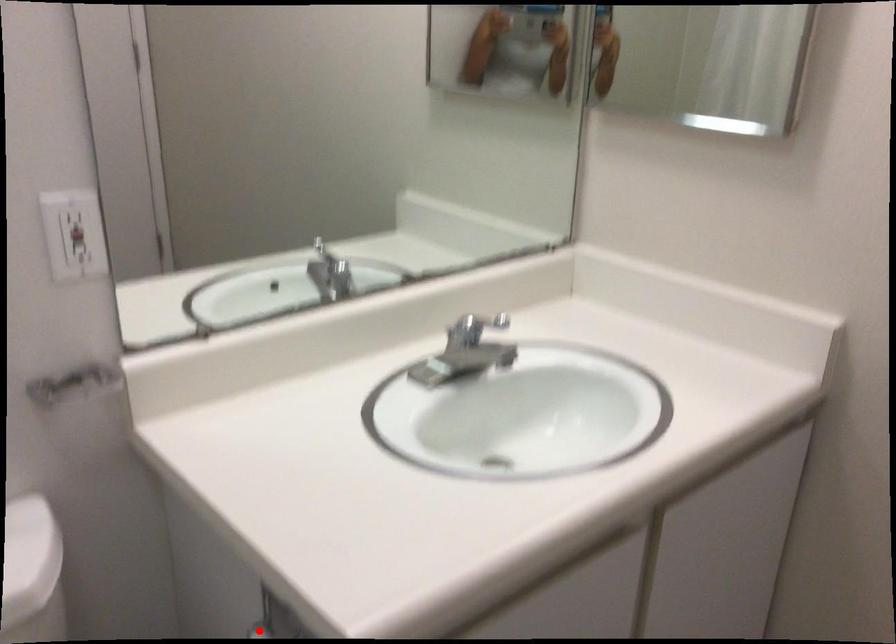
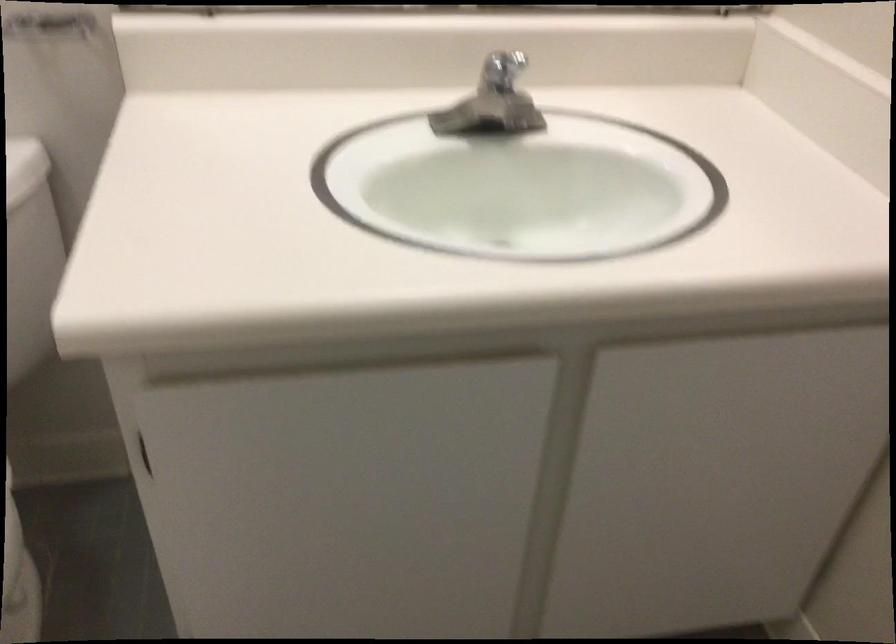
Question: I am providing you with two images of the same scene from different viewpoints. A red point is marked on the first image. Can you still see the location of the red point in image 2?

Choices:
 (A) Yes
 (B) No

Answer: (B)